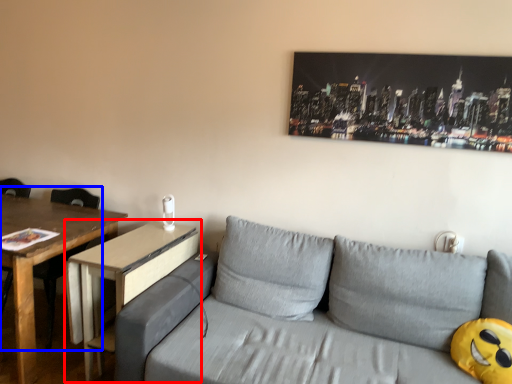
Question: Which object is further to the camera taking this photo, table (highlighted by a red box) or chair (highlighted by a blue box)?

Choices:
 (A) table
 (B) chair

Answer: (B)